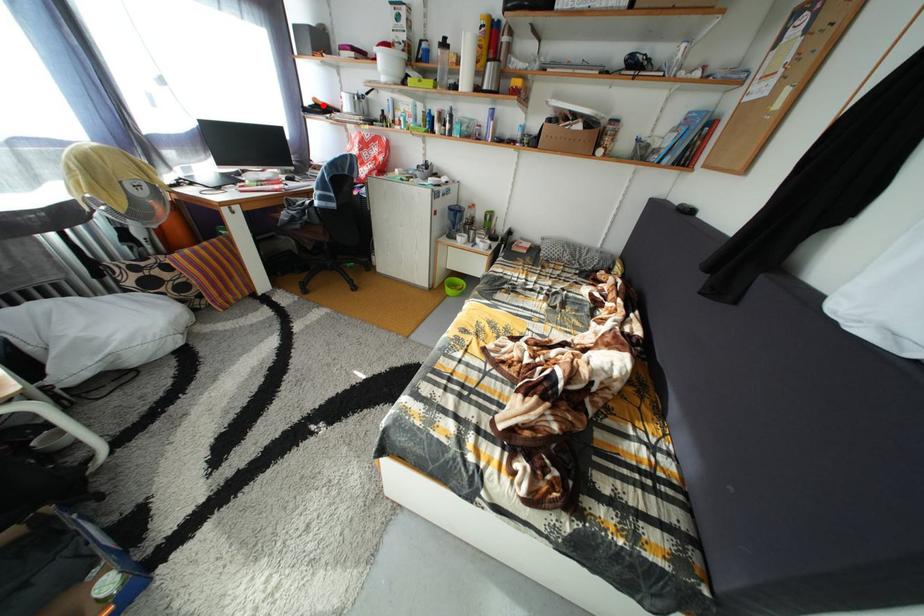
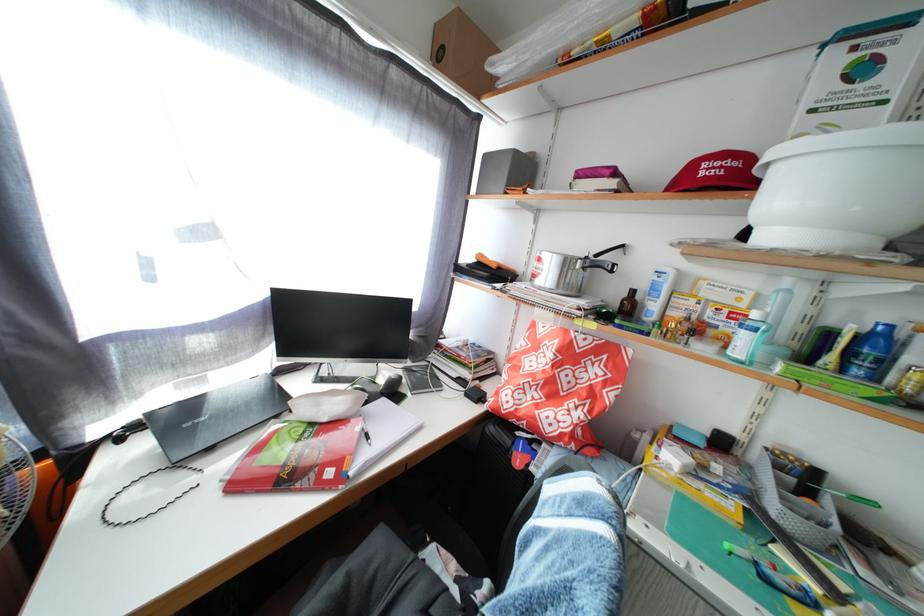
Locate, in the second image, the point that corresponds to the highlighted location in the first image.

(489, 262)